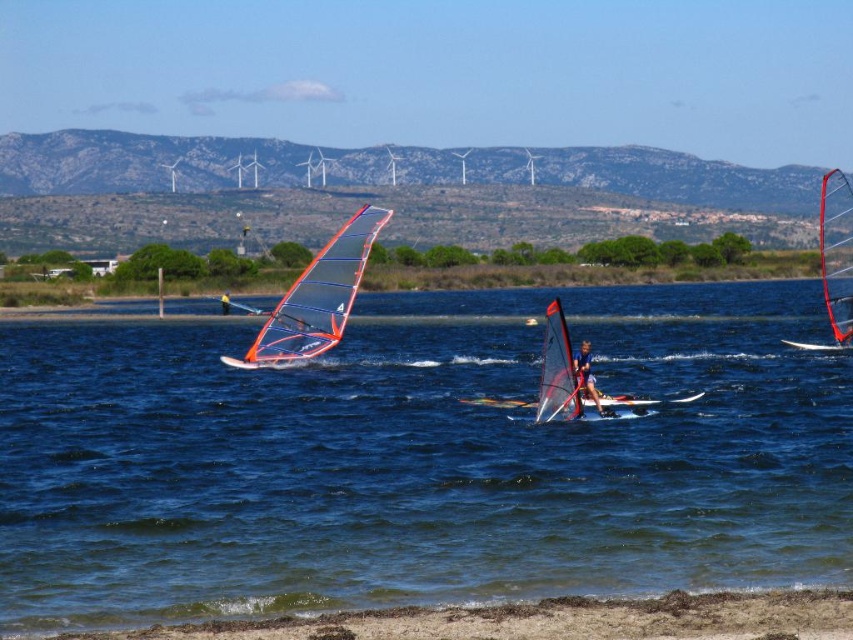
You are a windsurfer preparing to launch your board into the water. You have the blue matte windsurfing sail at center and the matte orange windsurfing board at center. Which one should you carry first to the water if you want to start assembling your equipment on the beach?

You should carry the blue matte windsurfing sail at center first because it is smaller than the matte orange windsurfing board at center, making it easier to handle on the beach.

Based on the photo, you are a photographer trying to capture the windsurfing action. You notice the blue water at center and the matte orange windsurfing board at center. Which object would you focus on if you want to capture the larger subject in your shot?

The blue water at center is bigger than the matte orange windsurfing board at center, so focusing on the blue water at center would capture the larger subject.